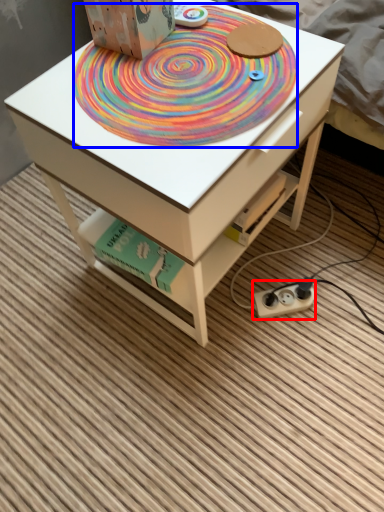
Question: Which object appears farthest to the camera in this image, plug (highlighted by a red box) or mat (highlighted by a blue box)?

Choices:
 (A) plug
 (B) mat

Answer: (A)